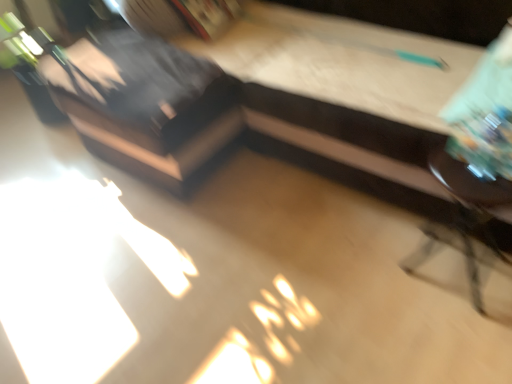
Locate an element on the screen. This screenshot has height=384, width=512. free space behind metallic dark brown swivel chair at right is located at coordinates (407, 229).